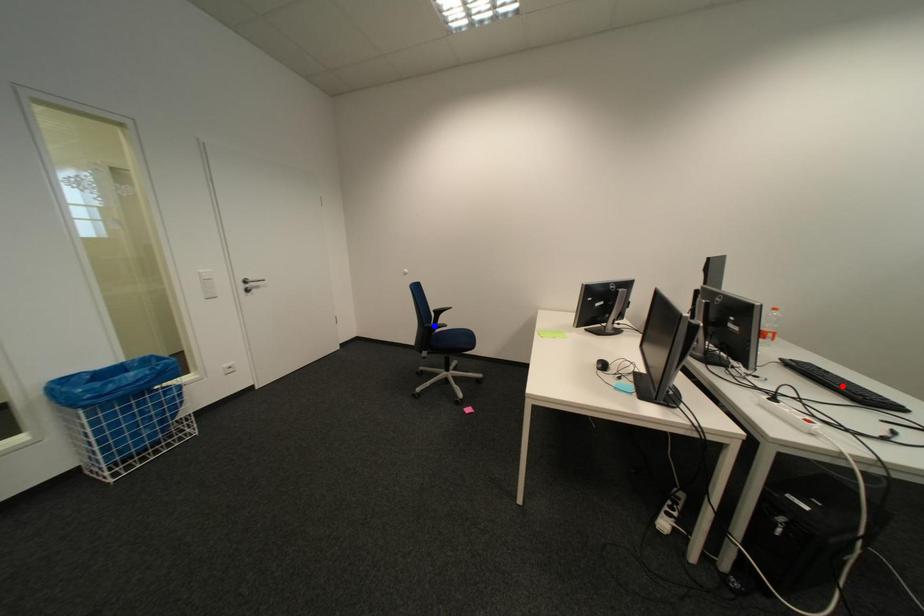
Question: In the image, two points are highlighted. Which point is nearer to the camera? Reply with the corresponding letter.

Choices:
 (A) blue point
 (B) red point

Answer: (B)